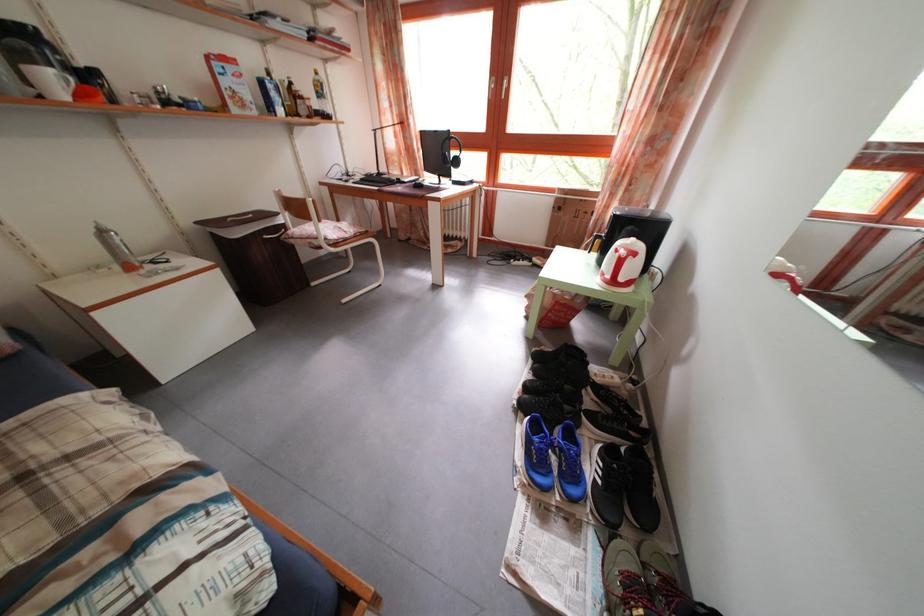
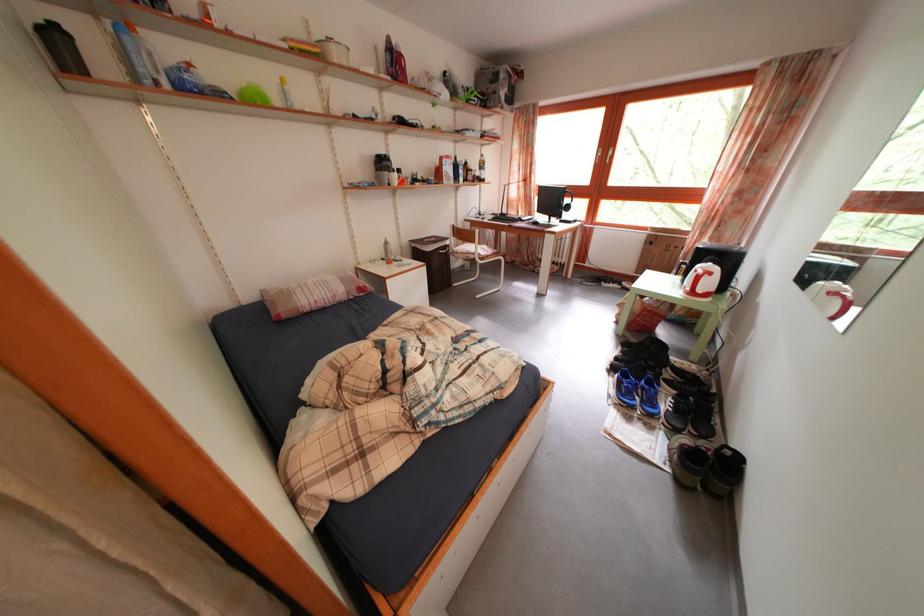
Question: Based on the continuous images, in which direction is the camera rotating? Reply with the corresponding letter.

Choices:
 (A) Left
 (B) Right
 (C) Up
 (D) Down

Answer: (A)